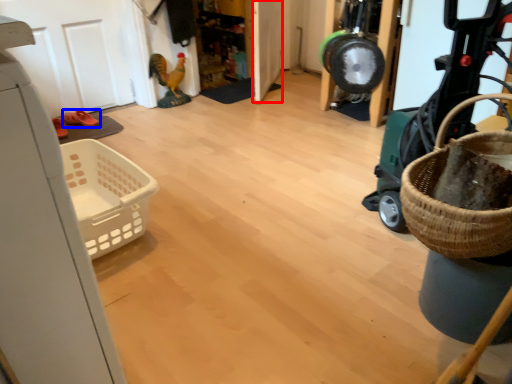
Question: Among these objects, which one is nearest to the camera, door (highlighted by a red box) or footwear (highlighted by a blue box)?

Choices:
 (A) door
 (B) footwear

Answer: (B)